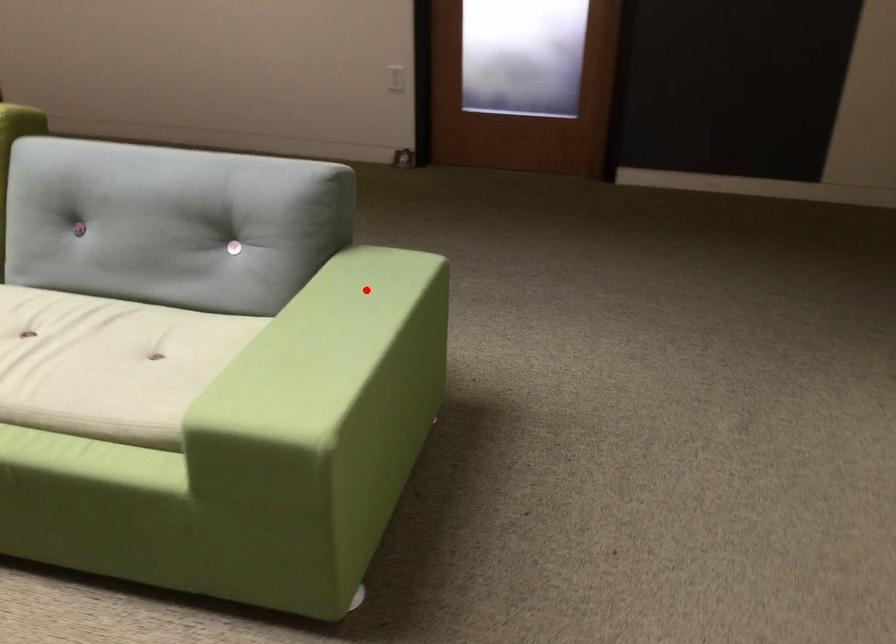
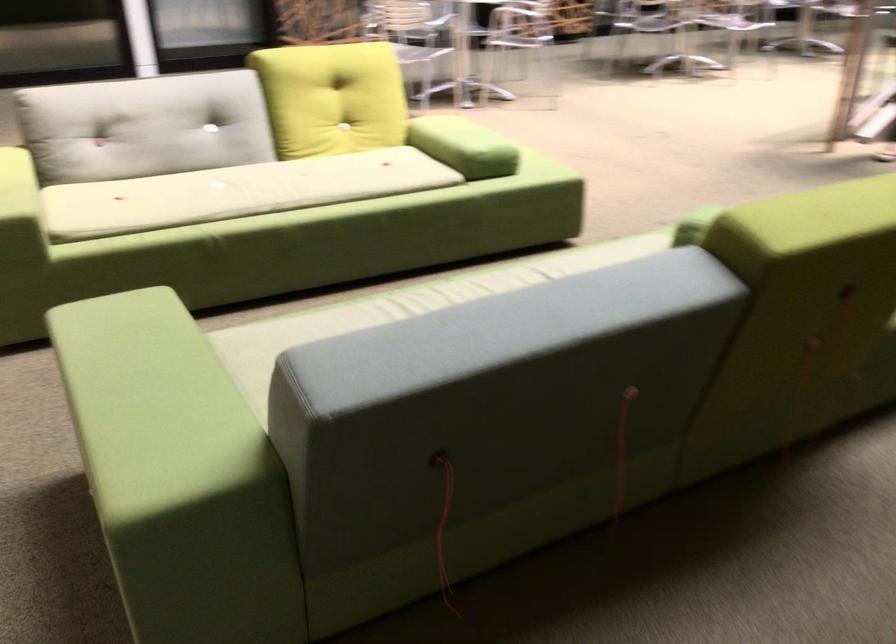
In the second image, find the point that corresponds to the highlighted location in the first image.

(151, 404)